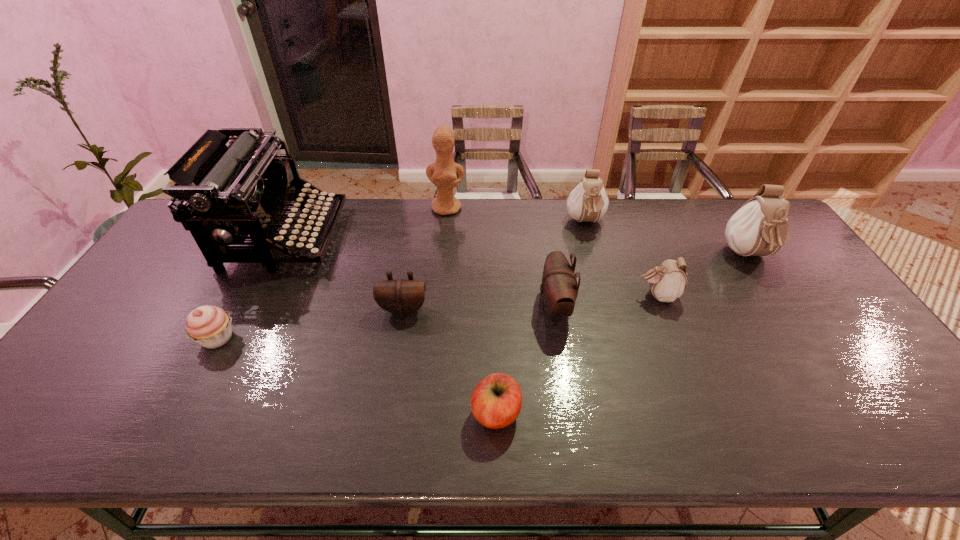
Where is `black typewriter`? The image size is (960, 540). black typewriter is located at coordinates (238, 192).

The width and height of the screenshot is (960, 540). In order to click on figurine in this screenshot , I will do `click(442, 173)`.

The image size is (960, 540). Identify the location of the rightmost white pouch. (759, 228).

What are the coordinates of `the tallest pouch` in the screenshot? It's located at (759, 228).

You are a GUI agent. You are given a task and a screenshot of the screen. Output one action in this format:
    pyautogui.click(x=<x>, y=<y>)
    Task: Click on the third pouch from right to left
    
    Given the screenshot: What is the action you would take?
    pyautogui.click(x=588, y=202)

You are a GUI agent. You are given a task and a screenshot of the screen. Output one action in this format:
    pyautogui.click(x=<x>, y=<y>)
    Task: Click on the second smallest white pouch
    Image resolution: width=960 pixels, height=540 pixels.
    Given the screenshot: What is the action you would take?
    pyautogui.click(x=588, y=202)

Where is `the fourth object from right to left`? The image size is (960, 540). the fourth object from right to left is located at coordinates (559, 289).

Locate an element on the screen. The width and height of the screenshot is (960, 540). the bigger brown pouch is located at coordinates (559, 289).

Find the location of a particular element. the smallest white pouch is located at coordinates (668, 281).

Where is `the eighth object from left to right`? the eighth object from left to right is located at coordinates (668, 281).